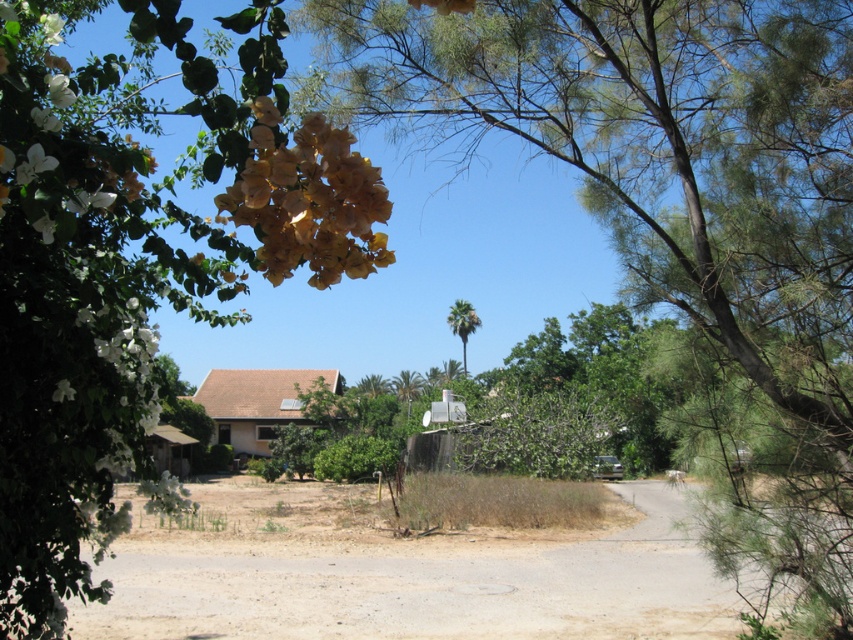
Question: Which of the following is the farthest from the observer?

Choices:
 (A) brown dry grass at lower center
 (B) green leafy tree at upper left

Answer: (A)

Question: Is green leafy tree at upper right further to the viewer compared to brown dry grass at lower center?

Choices:
 (A) no
 (B) yes

Answer: (A)

Question: Is green leafy tree at upper right above green leafy tree at upper left?

Choices:
 (A) no
 (B) yes

Answer: (A)

Question: Which point is closer to the camera?

Choices:
 (A) (221, 164)
 (B) (596, 612)
 (C) (471, 332)
 (D) (311, 262)

Answer: (A)

Question: Observing the image, what is the correct spatial positioning of green leafy tree at upper right in reference to green leafy palm at center?

Choices:
 (A) above
 (B) below

Answer: (B)

Question: Considering the real-world distances, which object is farthest from the green leafy tree at upper right?

Choices:
 (A) green leafy palm at center
 (B) yellow matte flower at upper left
 (C) green leafy tree at upper left
 (D) brown dry grass at lower center

Answer: (A)